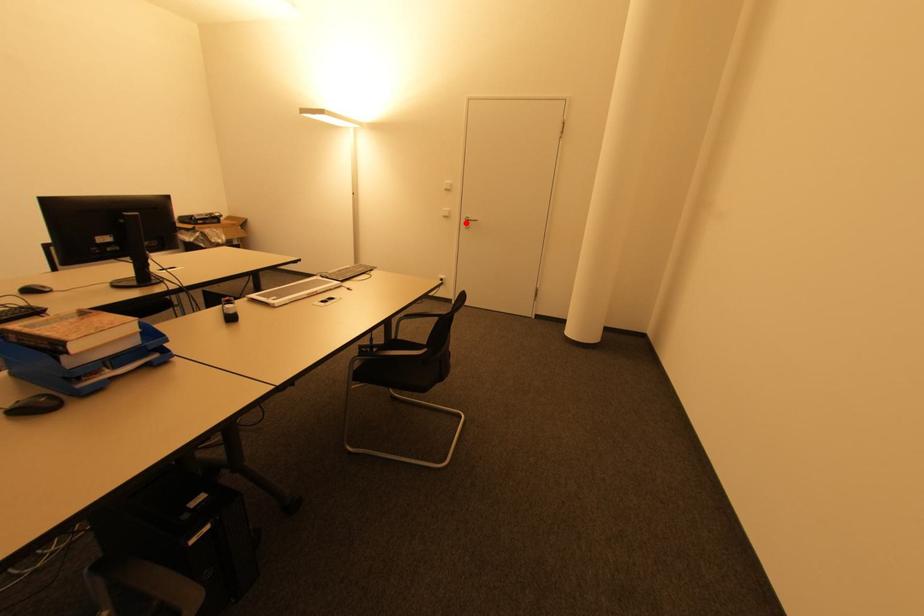
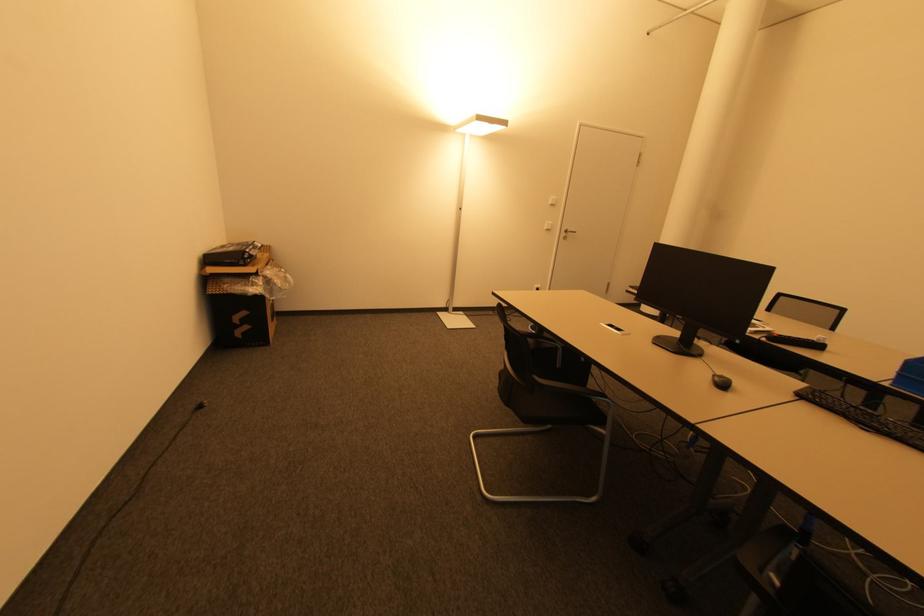
Question: I am providing you with two images of the same scene from different viewpoints. A red point is marked on the first image. Can you still see the location of the red point in image 2?

Choices:
 (A) Yes
 (B) No

Answer: (A)